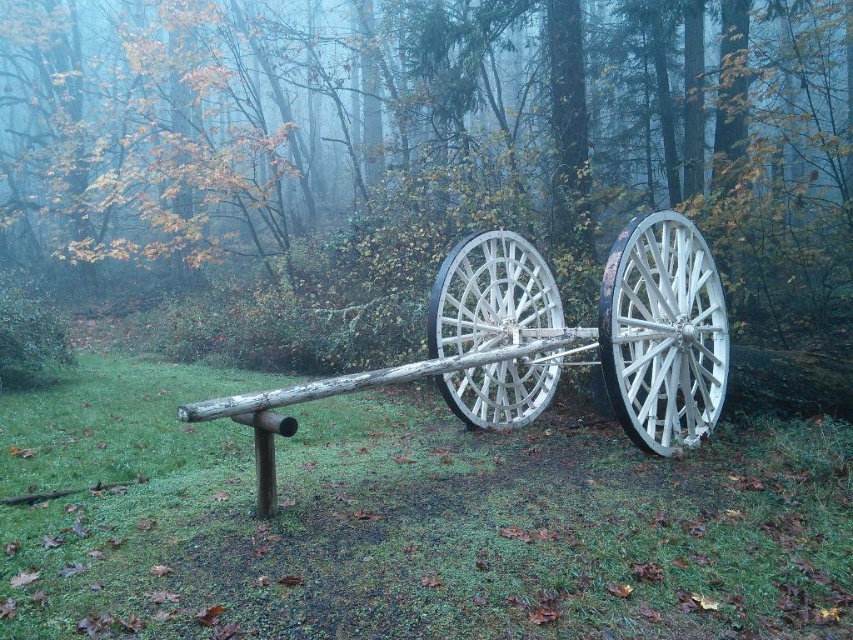
You are an explorer in the forest and need to transport items across the misty area. If you have a 1.2 meter wide item, can the white wooden cart at center or the white wooden wagon wheel at right accommodate it?

The white wooden cart at center has a larger width than the white wooden wagon wheel at right. Since the item is 1.2 meters wide, the white wooden cart at center may be able to accommodate it, while the white wooden wagon wheel at right might be too narrow.

You are standing in the forest and see the white wooden cart at center and the white wooden wagon wheel at right. Which object is closer to the left side of the image?

The white wooden cart at center is closer to the left side of the image than the white wooden wagon wheel at right.

Based on the photo, you are an explorer in the forest and want to cross the misty area. You see the green matte wood at center and the white wooden wheel at center. Which object is wider and can provide a larger surface to step on?

The green matte wood at center is wider than the white wooden wheel at center, so it can provide a larger surface to step on.